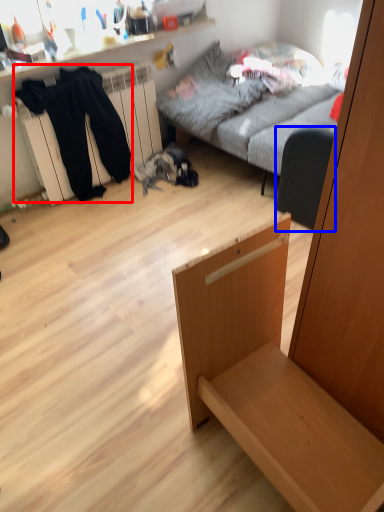
Question: Among these objects, which one is nearest to the camera, clothing (highlighted by a red box) or armchair (highlighted by a blue box)?

Choices:
 (A) clothing
 (B) armchair

Answer: (B)